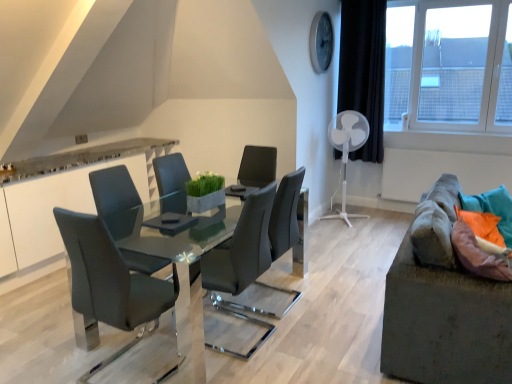
Question: In which direction should I rotate to look at matte gray chair at center, the 1th chair viewed from the right?

Choices:
 (A) left
 (B) right

Answer: (B)

Question: From the image's perspective, would you say white plastic mechanical fan at right is positioned over matte gray chair at center, the first chair in the back-to-front sequence?

Choices:
 (A) yes
 (B) no

Answer: (A)

Question: From a real-world perspective, is white plastic mechanical fan at right physically above matte gray chair at center, which is the second chair in front-to-back order?

Choices:
 (A) yes
 (B) no

Answer: (A)

Question: Is matte gray chair at center, arranged as the 2th chair when viewed from the left, at the back of white plastic mechanical fan at right?

Choices:
 (A) no
 (B) yes

Answer: (A)

Question: Are white plastic mechanical fan at right and matte gray chair at center, which is the second chair in front-to-back order, making contact?

Choices:
 (A) yes
 (B) no

Answer: (B)

Question: Does white plastic mechanical fan at right have a lesser height compared to matte gray chair at center, which is the second chair in front-to-back order?

Choices:
 (A) no
 (B) yes

Answer: (A)

Question: Is white plastic mechanical fan at right at the right side of matte gray chair at center, which is the second chair in front-to-back order?

Choices:
 (A) yes
 (B) no

Answer: (A)

Question: Is matte gray chair at left, which appears as the 1th chair when viewed from the front, closer to the viewer compared to glossy glass table at center?

Choices:
 (A) yes
 (B) no

Answer: (A)

Question: Is the surface of matte gray chair at left, which appears as the 1th chair when viewed from the front, in direct contact with glossy glass table at center?

Choices:
 (A) yes
 (B) no

Answer: (B)

Question: From the image's perspective, is matte gray chair at left, the 1th chair positioned from the left, located beneath glossy glass table at center?

Choices:
 (A) no
 (B) yes

Answer: (B)

Question: Is matte gray chair at left, the 1th chair positioned from the left, at the left side of glossy glass table at center?

Choices:
 (A) yes
 (B) no

Answer: (A)

Question: Is matte gray chair at left, which appears as the 1th chair when viewed from the front, positioned behind glossy glass table at center?

Choices:
 (A) yes
 (B) no

Answer: (B)

Question: Is matte gray chair at left, positioned as the 2th chair in right-to-left order, looking in the opposite direction of glossy glass table at center?

Choices:
 (A) no
 (B) yes

Answer: (B)

Question: Is matte gray chair at center, the first chair in the back-to-front sequence, thinner than textured gray couch at right?

Choices:
 (A) yes
 (B) no

Answer: (A)